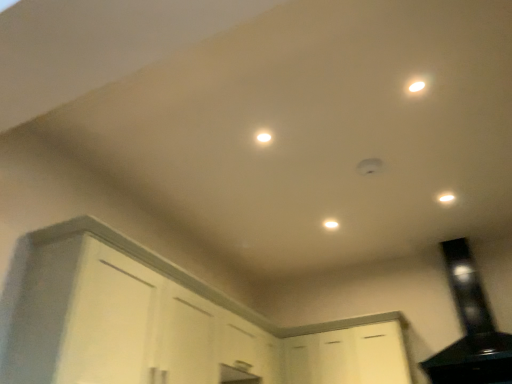
Question: Does white glossy light at upper right, which is the first light in right-to-left order, have a lesser width compared to white matte light fixture at center?

Choices:
 (A) yes
 (B) no

Answer: (A)

Question: Is white glossy light at upper right, the 1th light from the back, to the right of white matte light fixture at center from the viewer's perspective?

Choices:
 (A) yes
 (B) no

Answer: (A)

Question: From a real-world perspective, does white glossy light at upper right, the third light viewed from the front, sit lower than white matte light fixture at center?

Choices:
 (A) no
 (B) yes

Answer: (B)

Question: Is white glossy light at upper right, which is the first light in right-to-left order, positioned far away from white matte light fixture at center?

Choices:
 (A) no
 (B) yes

Answer: (A)

Question: From the image's perspective, is white glossy light at upper right, which is counted as the 1th light, starting from the bottom, located beneath white matte light fixture at center?

Choices:
 (A) no
 (B) yes

Answer: (A)

Question: From a real-world perspective, is white matte cabinet at lower center, the 2th cabinetry in the left-to-right sequence, positioned above or below white glossy light at upper right, which ranks as the 3th light in left-to-right order?

Choices:
 (A) above
 (B) below

Answer: (B)

Question: Considering the positions of white matte cabinet at lower center, which ranks as the 1th cabinetry in right-to-left order, and white glossy light at upper right, which ranks as the 3th light in left-to-right order, in the image, is white matte cabinet at lower center, which ranks as the 1th cabinetry in right-to-left order, wider or thinner than white glossy light at upper right, which ranks as the 3th light in left-to-right order,?

Choices:
 (A) wide
 (B) thin

Answer: (A)

Question: In the image, is white matte cabinet at lower center, which ranks as the 1th cabinetry in right-to-left order, positioned in front of or behind white glossy light at upper right, which is the first light in right-to-left order?

Choices:
 (A) front
 (B) behind

Answer: (B)

Question: Do you think white matte cabinet at lower center, which ranks as the 1th cabinetry in right-to-left order, is within white glossy light at upper right, placed as the 3th light when sorted from top to bottom, or outside of it?

Choices:
 (A) inside
 (B) outside

Answer: (B)

Question: Considering the positions of white glossy light at upper right, the 3th light when ordered from back to front, and black glossy exhaust hood at upper right in the image, is white glossy light at upper right, the 3th light when ordered from back to front, wider or thinner than black glossy exhaust hood at upper right?

Choices:
 (A) thin
 (B) wide

Answer: (A)

Question: Considering the positions of white glossy light at upper right, which is counted as the first light, starting from the front, and black glossy exhaust hood at upper right in the image, is white glossy light at upper right, which is counted as the first light, starting from the front, taller or shorter than black glossy exhaust hood at upper right?

Choices:
 (A) short
 (B) tall

Answer: (A)

Question: In the image, is white glossy light at upper right, the 3th light when ordered from back to front, on the left side or the right side of black glossy exhaust hood at upper right?

Choices:
 (A) right
 (B) left

Answer: (B)

Question: From the image's perspective, is white glossy light at upper right, the 3th light when ordered from back to front, located above or below black glossy exhaust hood at upper right?

Choices:
 (A) above
 (B) below

Answer: (A)

Question: Which is correct: white glossy light at upper right, which is counted as the 1th light, starting from the bottom, is inside white matte cabinet at lower left, marked as the 1th cabinetry in a left-to-right arrangement, or outside of it?

Choices:
 (A) inside
 (B) outside

Answer: (B)

Question: From a real-world perspective, is white glossy light at upper right, which is the first light in right-to-left order, above or below white matte cabinet at lower left, marked as the second cabinetry in a right-to-left arrangement?

Choices:
 (A) below
 (B) above

Answer: (B)